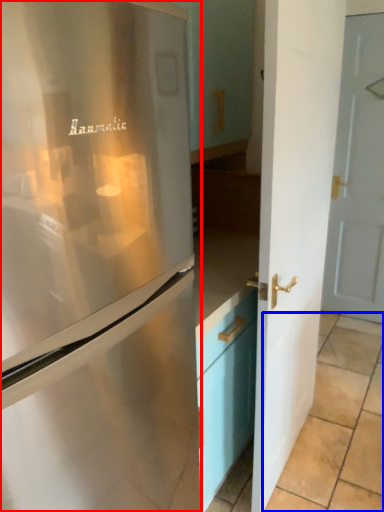
Question: Which object is closer to the camera taking this photo, refrigerator (highlighted by a red box) or tile (highlighted by a blue box)?

Choices:
 (A) refrigerator
 (B) tile

Answer: (A)